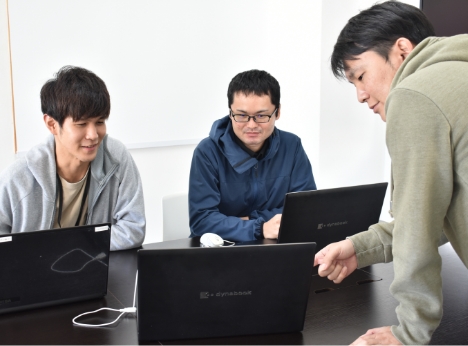
Identify the location of chair. The height and width of the screenshot is (346, 468). (182, 218).